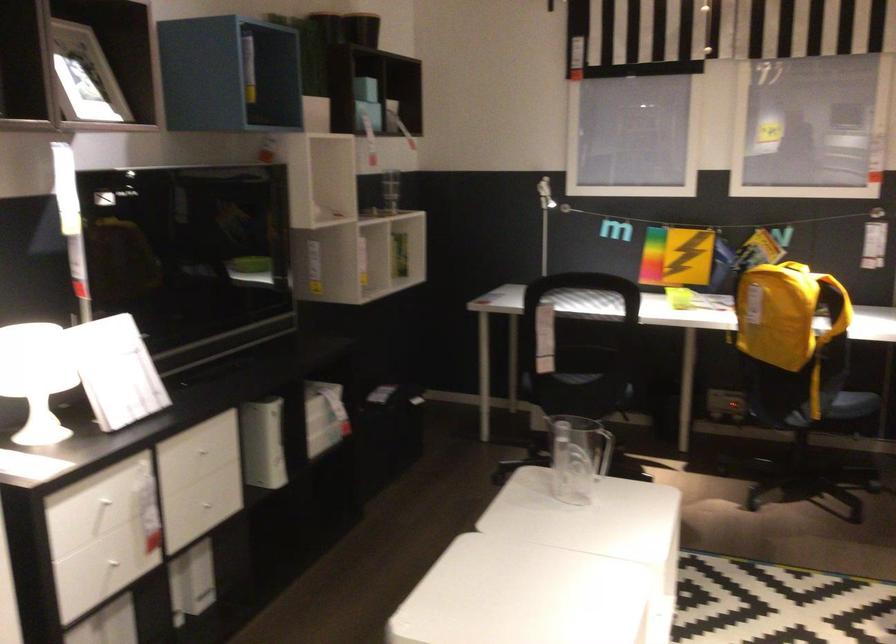
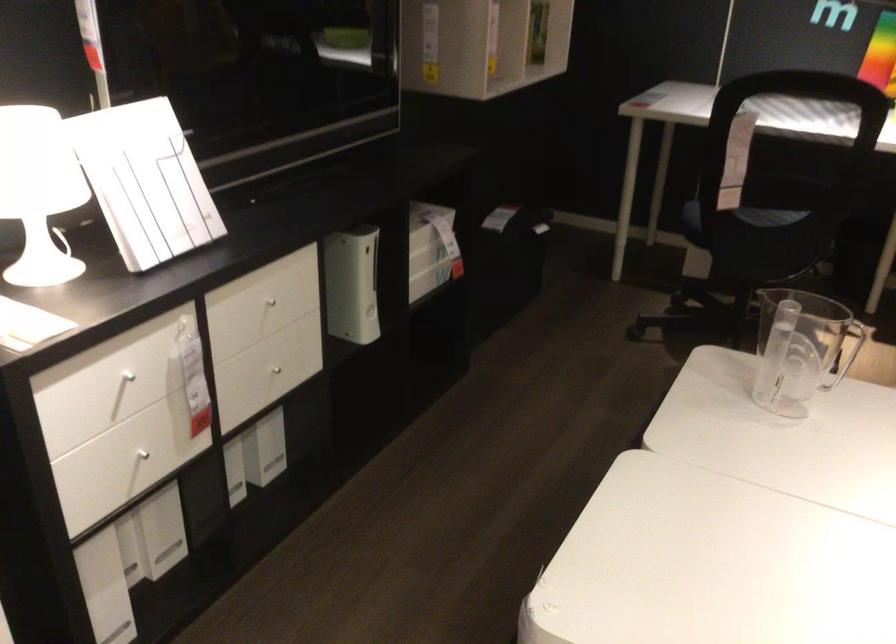
The point at [393,428] is marked in the first image. Where is the corresponding point in the second image?

(507, 263)